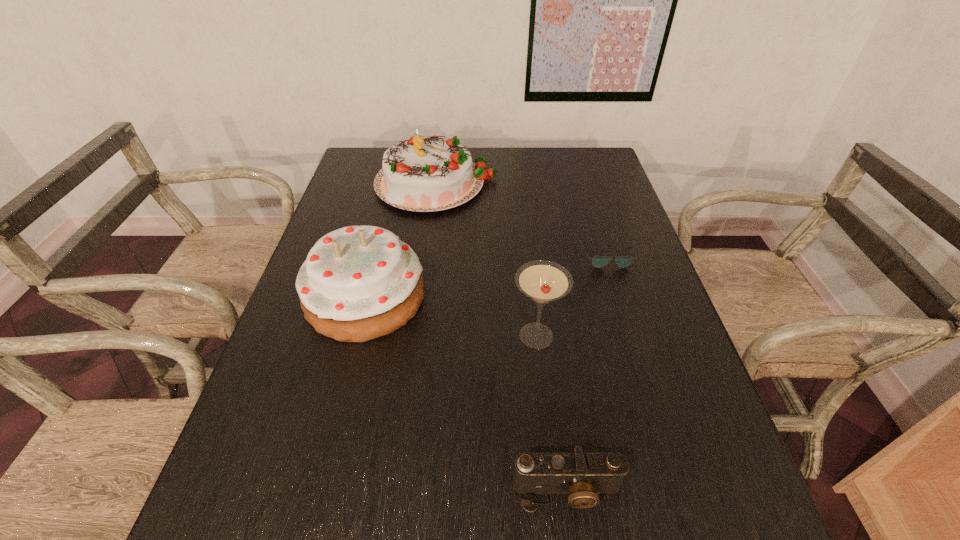
Identify the location of the farther cake. (x=423, y=174).

Where is `the nearer cake`? Image resolution: width=960 pixels, height=540 pixels. the nearer cake is located at coordinates (357, 283).

You are a GUI agent. You are given a task and a screenshot of the screen. Output one action in this format:
    pyautogui.click(x=<x>, y=<y>)
    Task: Click on the martini
    This screenshot has width=960, height=540.
    Given the screenshot: What is the action you would take?
    pyautogui.click(x=542, y=281)

Find the location of a particular element. The width and height of the screenshot is (960, 540). the nearest object is located at coordinates (582, 475).

Find the location of a particular element. The width and height of the screenshot is (960, 540). camera is located at coordinates (582, 475).

Find the location of `the rightmost object`. the rightmost object is located at coordinates (598, 261).

I want to click on sunglasses, so click(x=598, y=261).

At what (x,y) coordinates should I click in order to perform the action: click on vacant region located 0.050m on the back of the farther cake. Please return your answer as a coordinate pair (x, y). The width and height of the screenshot is (960, 540). Looking at the image, I should click on (442, 147).

Where is `vacant space situated on the right of the nearer cake`? The width and height of the screenshot is (960, 540). vacant space situated on the right of the nearer cake is located at coordinates (445, 298).

Locate an element on the screen. free space located 0.360m on the back of the martini is located at coordinates (523, 224).